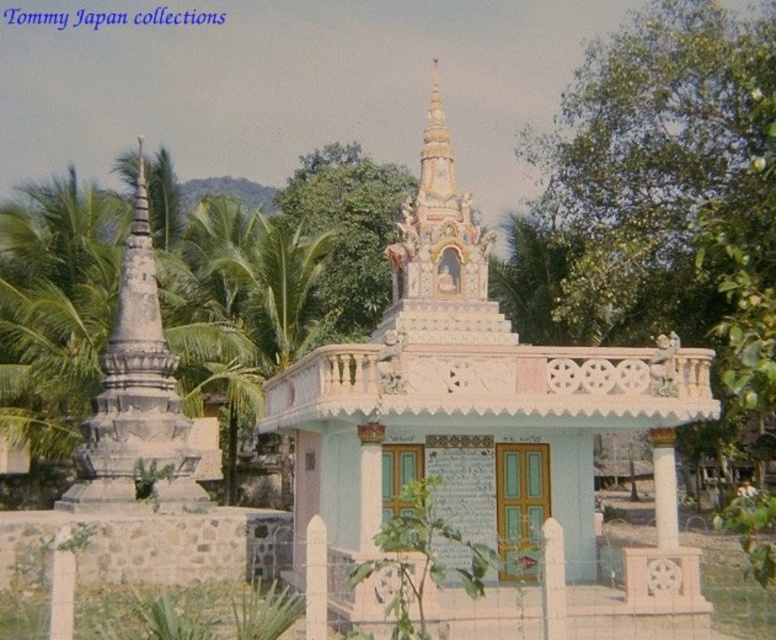
You are a gardener who needs to water both the green leafy tree at upper center and the green leafy palm tree at center. If your watering can holds exactly 3 liters of water and each tree requires 1.5 liters to be sufficiently watered, can you water both trees without needing to refill your watering can?

Both the green leafy tree at upper center and the green leafy palm tree at center require a total of 3 liters of water. Since your watering can holds exactly 3 liters, you can water both trees without needing to refill.

You are an architect designing a new garden layout and need to place both the green leafy tree at center and the green leafy tree at upper center. Based on their sizes, which tree should be placed closer to the entrance to ensure visibility?

The green leafy tree at center has a larger size compared to the green leafy tree at upper center, so placing the larger tree closer to the entrance will ensure better visibility as it can be seen from a distance.

You are standing in front of the temple and notice two green leafy trees. One is labeled as the green leafy tree at center and the other as the green leafy tree at upper center. Which tree is located to the right of the other?

The green leafy tree at center is positioned on the right side of green leafy tree at upper center, so the green leafy tree at center is to the right of the green leafy tree at upper center.